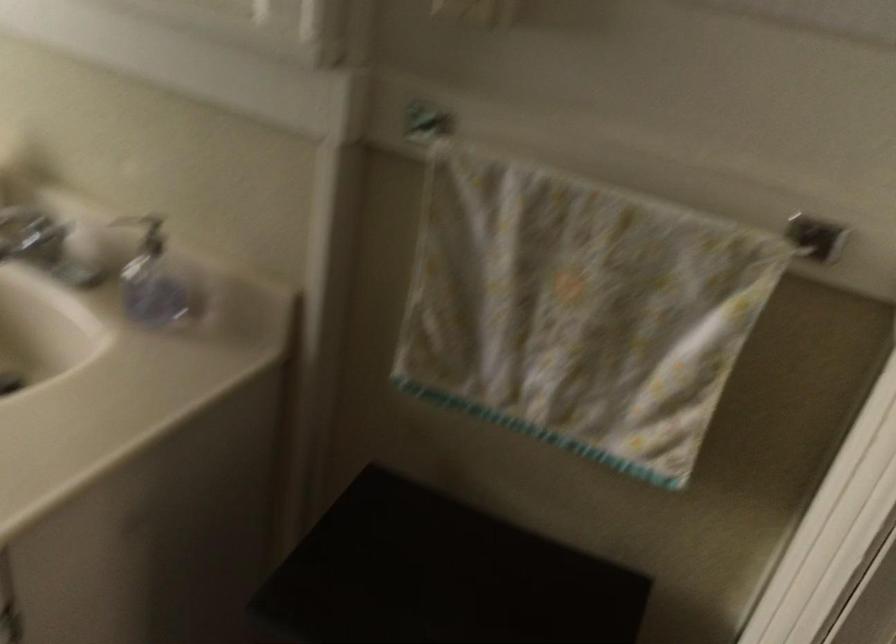
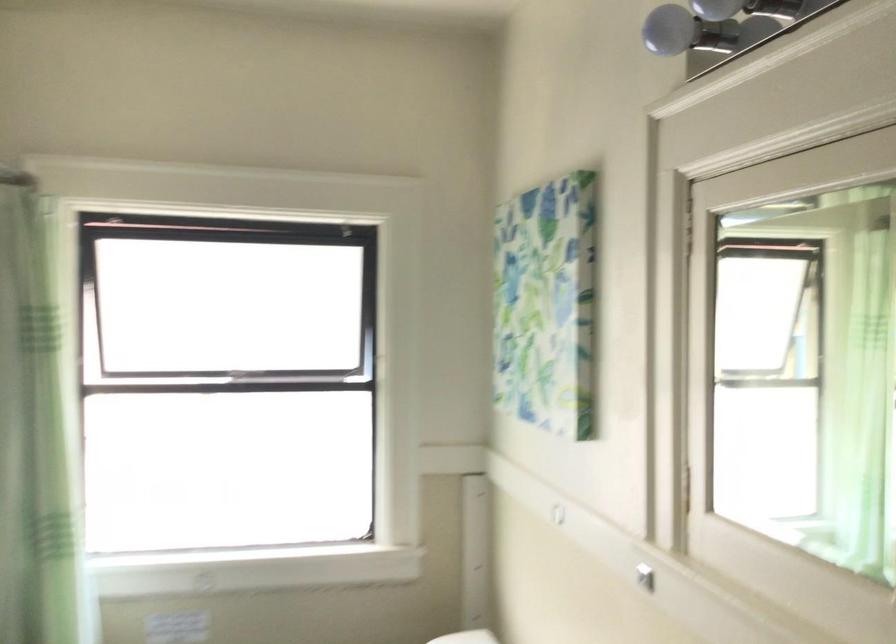
How did the camera likely rotate?

The camera's rotation is toward left-up.